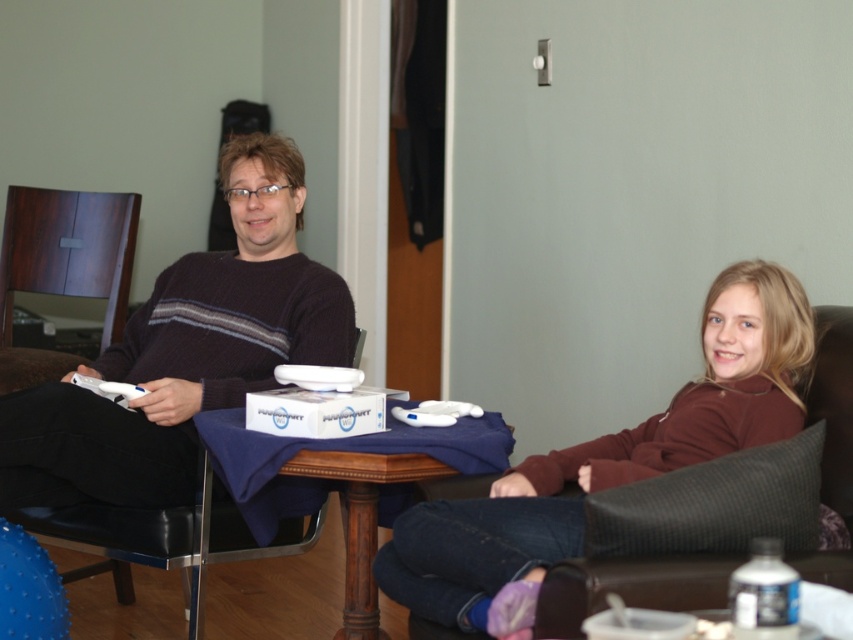
You are trying to decide which sweater to wear for a cold day. You see the dark brown sweater at center and the brown fleece sweater at center in the image. Which one is warmer?

The brown fleece sweater at center is warmer than the dark brown sweater at center because fleece is typically a warmer material and the description states it is thicker.

You are a delivery person who needs to place a small package between the dark brown sweater at center and the dark wood chair at left. Can you fit it there?

The dark brown sweater at center and dark wood chair at left are 28.91 inches apart, so yes, the package can fit between them since the space is sufficient.

You are a tailor who needs to determine if the brown fleece sweater at center can be placed on the wooden table at center without hanging over the edges. Based on the scene, can you confirm if the sweater will fit?

The brown fleece sweater at center has a larger size compared to wooden table at center, so it will not fit without hanging over the edges.